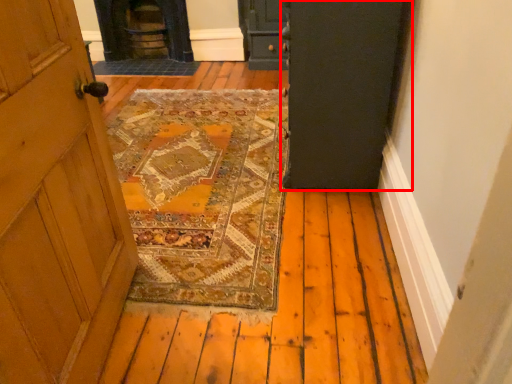
Question: From the image's perspective, what is the correct spatial positioning of door (annotated by the red box) in reference to stove?

Choices:
 (A) below
 (B) above

Answer: (A)